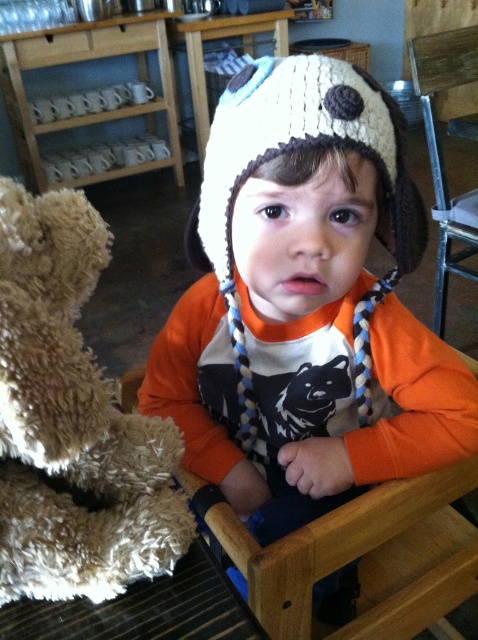
Does white knitted hat at center have a lesser height compared to fuzzy beige teddy bear at left?

No.

Identify the location of white knitted hat at center. The width and height of the screenshot is (478, 640). (305, 305).